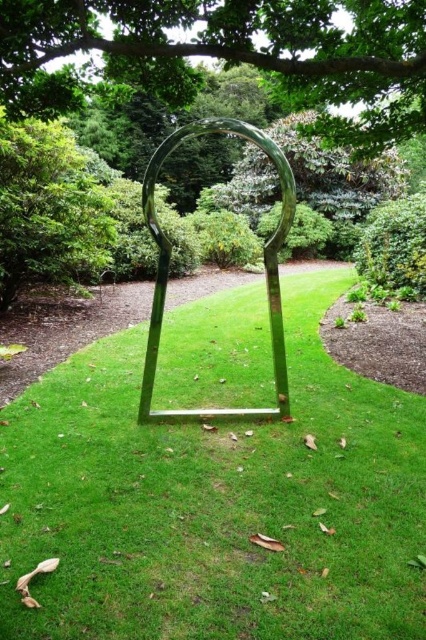
Consider the image. You are standing in the garden and want to take a photo of the green metallic frame at center and the green leafy tree at upper center. Which object will appear closer to the camera in the photo?

The green metallic frame at center will appear closer to the camera in the photo because it is positioned in front of the green leafy tree at upper center.

You are standing in the garden and want to take a photo of the green metallic frame at center and the polished metal arch at center. If you face the sculpture, which object should you look to your left to capture in the frame?

The polished metal arch at center is to the left of the green metallic frame at center. So, to capture the polished metal arch at center, you should look to your left since it is positioned to the left of the green metallic frame at center.